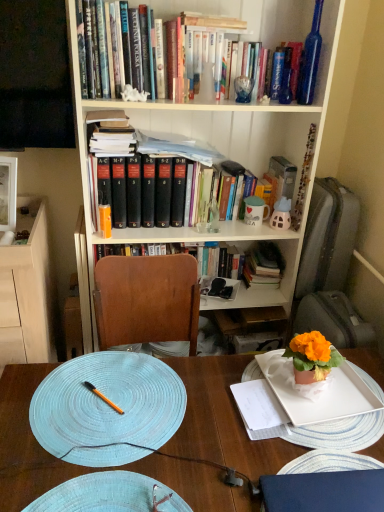
At what (x,y) coordinates should I click in order to perform the action: click on free location above blue woven placemat at center (from a real-world perspective). Please return your answer as a coordinate pair (x, y). The height and width of the screenshot is (512, 384). Looking at the image, I should click on (200, 426).